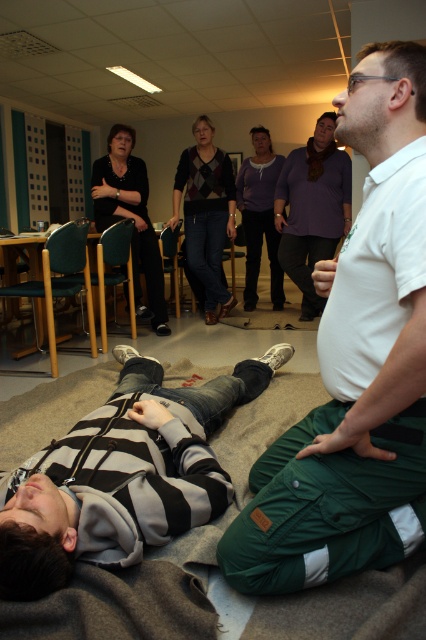
Question: Can you confirm if striped fabric relax at lower left is positioned above matte gray sweater at center?

Choices:
 (A) no
 (B) yes

Answer: (A)

Question: Which of these objects is positioned closest to the purple sweater at center?

Choices:
 (A) argyle sweater at center
 (B) white cotton shirt at upper right
 (C) black matte shirt at upper left

Answer: (A)

Question: Can you confirm if black matte shirt at upper left is positioned above matte gray sweater at center?

Choices:
 (A) no
 (B) yes

Answer: (A)

Question: Which object is farther from the camera taking this photo?

Choices:
 (A) white cotton shirt at upper right
 (B) matte gray sweater at center
 (C) black matte shirt at upper left

Answer: (B)

Question: Can you confirm if white cotton shirt at upper right is positioned to the right of matte gray sweater at center?

Choices:
 (A) yes
 (B) no

Answer: (B)

Question: Among these objects, which one is farthest from the camera?

Choices:
 (A) black matte shirt at upper left
 (B) matte gray sweater at center
 (C) white cotton shirt at upper right

Answer: (B)